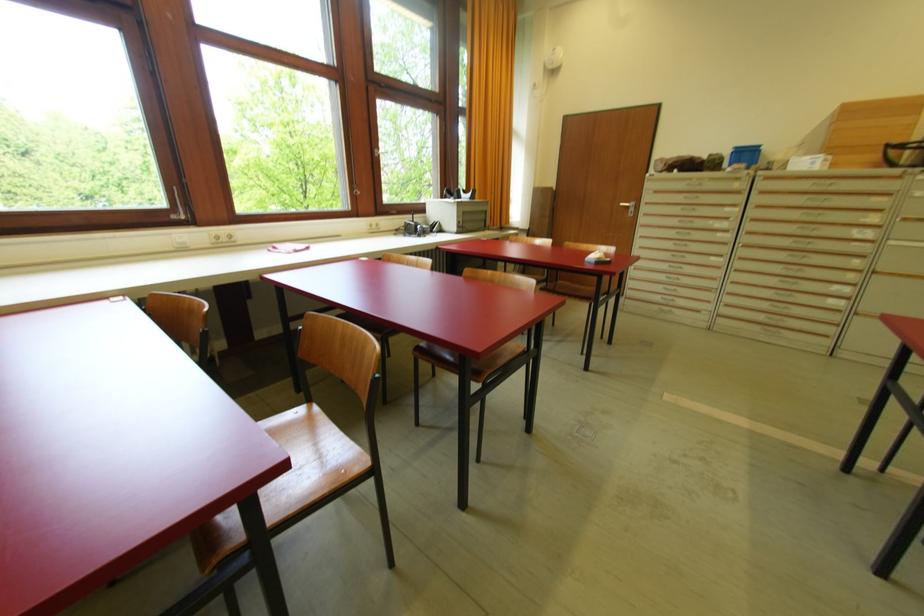
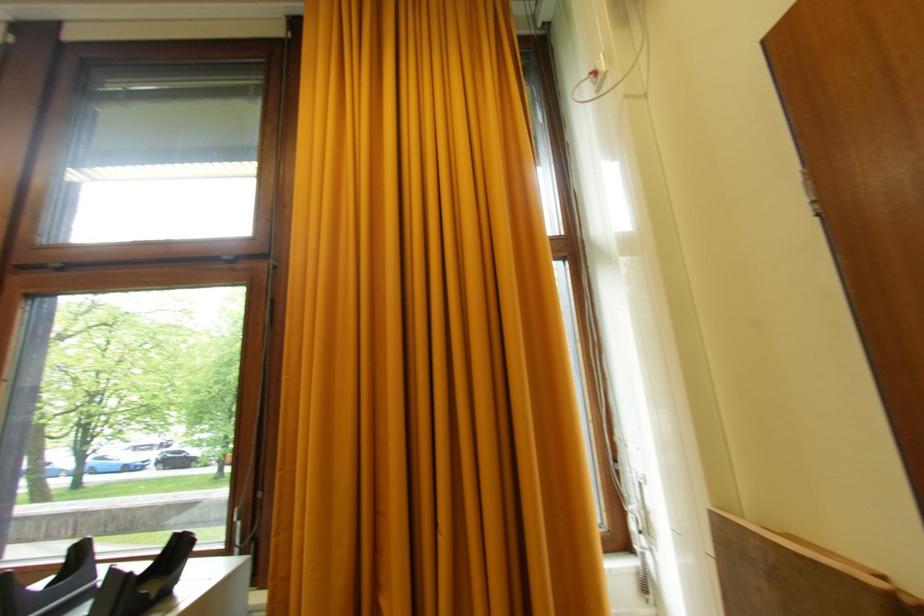
Locate, in the second image, the point that corresponds to point (384, 89) in the first image.

(62, 272)